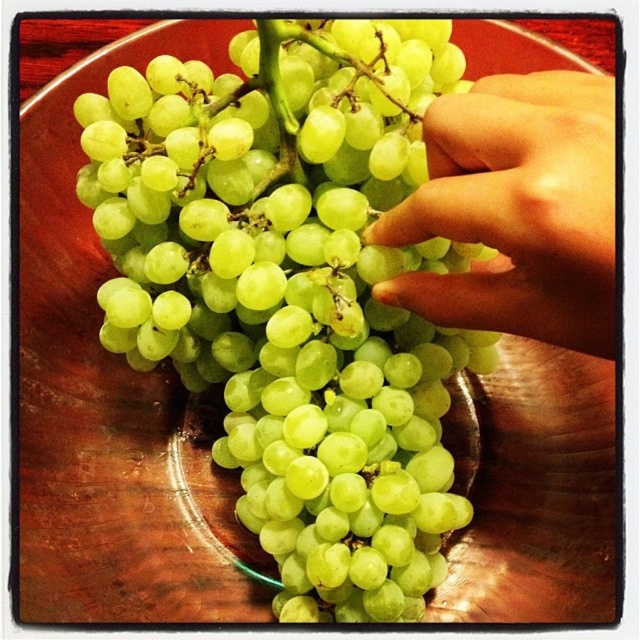
Question: Which point is farther from the camera taking this photo?

Choices:
 (A) (520, 278)
 (B) (422, 100)

Answer: (B)

Question: Among these points, which one is farthest from the camera?

Choices:
 (A) (384, 385)
 (B) (525, 172)

Answer: (A)

Question: Does green matte grapes at center appear on the right side of smooth skin hand at upper right?

Choices:
 (A) no
 (B) yes

Answer: (A)

Question: Is green matte grapes at center smaller than smooth skin hand at upper right?

Choices:
 (A) no
 (B) yes

Answer: (A)

Question: Is green matte grapes at center to the right of smooth skin hand at upper right from the viewer's perspective?

Choices:
 (A) yes
 (B) no

Answer: (B)